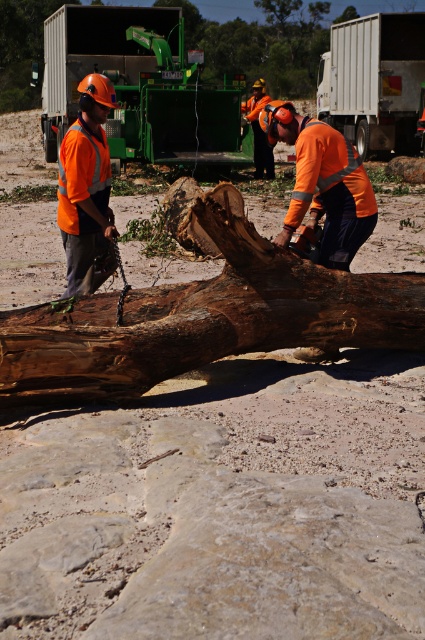
Question: Which object appears farthest from the camera in this image?

Choices:
 (A) brown rough wood at center
 (B) green metallic trailer truck at upper center
 (C) high visibility orange safety vest at left

Answer: (B)

Question: Is brown rough wood at center positioned behind white matte trailer truck at upper center?

Choices:
 (A) yes
 (B) no

Answer: (B)

Question: From the image, what is the correct spatial relationship of brown rough wood at center in relation to green metallic trailer truck at upper center?

Choices:
 (A) below
 (B) above

Answer: (A)

Question: Does brown rough wood at center have a greater width compared to white matte trailer truck at upper center?

Choices:
 (A) yes
 (B) no

Answer: (A)

Question: Estimate the real-world distances between objects in this image. Which object is farther from the brown rough wood at center?

Choices:
 (A) white matte trailer truck at upper center
 (B) green metallic trailer truck at upper center

Answer: (A)

Question: Which of these objects is positioned farthest from the high visibility orange safety vest at left?

Choices:
 (A) white matte trailer truck at upper center
 (B) green metallic trailer truck at upper center
 (C) brown rough wood at center

Answer: (A)